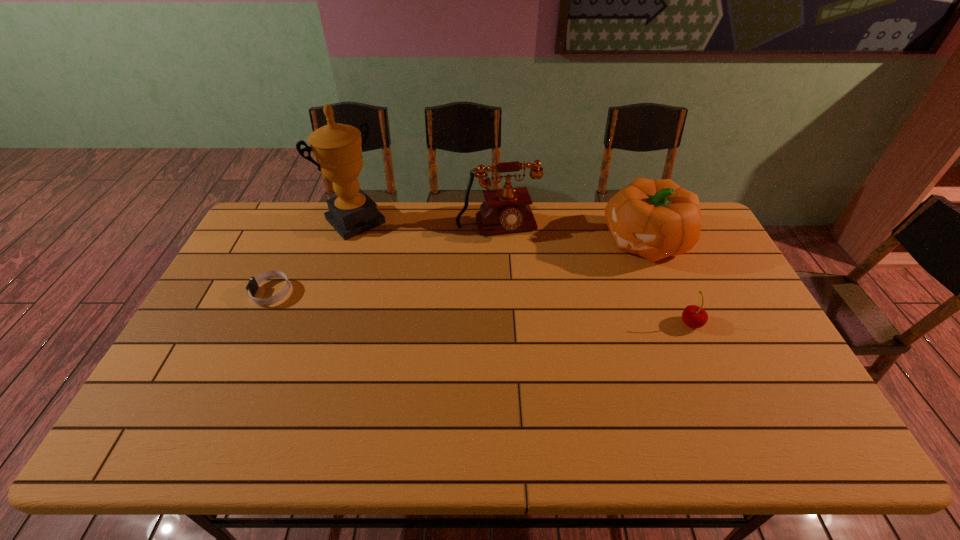
The image size is (960, 540). Identify the location of telephone located in the far edge section of the desktop. (504, 210).

The image size is (960, 540). I want to click on object that is at the left edge, so click(252, 286).

Where is `object at the right edge`? The width and height of the screenshot is (960, 540). object at the right edge is located at coordinates (655, 219).

The image size is (960, 540). I want to click on object that is at the far right corner, so click(655, 219).

The image size is (960, 540). Identify the location of vacant region at the far edge of the desktop. (454, 226).

In the image, there is a desktop. Where is `vacant space at the near edge`? vacant space at the near edge is located at coordinates (421, 393).

Identify the location of blank space at the left edge. The image size is (960, 540). (210, 318).

The image size is (960, 540). I want to click on vacant space at the right edge, so click(774, 362).

I want to click on unoccupied position between the third object from left to right and the wristband, so click(x=385, y=260).

In order to click on vacant area that lies between the telephone and the nearest object in this screenshot , I will do `click(594, 275)`.